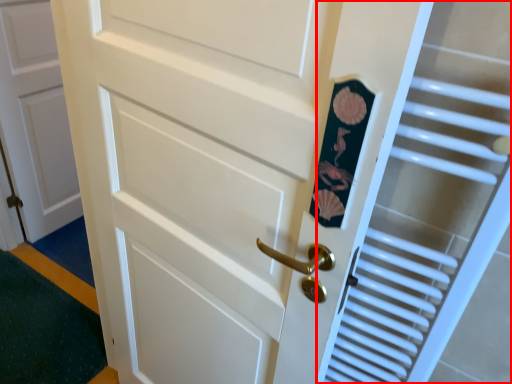
Question: In this image, where is elevator (annotated by the red box) located relative to door?

Choices:
 (A) left
 (B) right

Answer: (B)